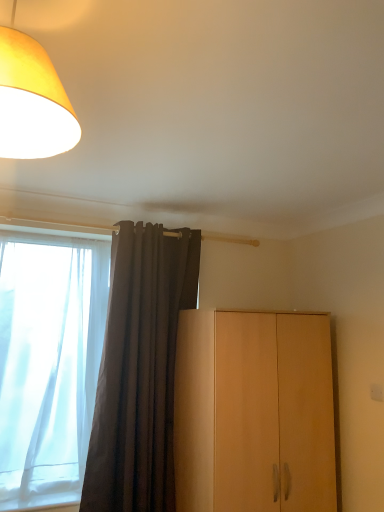
Question: From a real-world perspective, is dark gray fabric curtain at center located beneath white sheer curtain at left?

Choices:
 (A) no
 (B) yes

Answer: (B)

Question: Is dark gray fabric curtain at center positioned with its back to white sheer curtain at left?

Choices:
 (A) yes
 (B) no

Answer: (B)

Question: Can you confirm if dark gray fabric curtain at center is bigger than white sheer curtain at left?

Choices:
 (A) yes
 (B) no

Answer: (B)

Question: Is dark gray fabric curtain at center further to camera compared to white sheer curtain at left?

Choices:
 (A) no
 (B) yes

Answer: (A)

Question: Is dark gray fabric curtain at center shorter than white sheer curtain at left?

Choices:
 (A) yes
 (B) no

Answer: (B)

Question: From a real-world perspective, is yellow fabric lampshade at upper left above or below dark gray fabric curtain at center?

Choices:
 (A) above
 (B) below

Answer: (A)

Question: Is yellow fabric lampshade at upper left wider or thinner than dark gray fabric curtain at center?

Choices:
 (A) wide
 (B) thin

Answer: (A)

Question: Based on their sizes in the image, would you say yellow fabric lampshade at upper left is bigger or smaller than dark gray fabric curtain at center?

Choices:
 (A) small
 (B) big

Answer: (A)

Question: From the image's perspective, is yellow fabric lampshade at upper left positioned above or below dark gray fabric curtain at center?

Choices:
 (A) below
 (B) above

Answer: (B)

Question: Considering the relative positions of light wood cabinet at right and white sheer curtain at left in the image provided, is light wood cabinet at right to the left or to the right of white sheer curtain at left?

Choices:
 (A) right
 (B) left

Answer: (A)

Question: From a real-world perspective, relative to white sheer curtain at left, is light wood cabinet at right vertically above or below?

Choices:
 (A) below
 (B) above

Answer: (A)

Question: Considering the positions of light wood cabinet at right and white sheer curtain at left in the image, is light wood cabinet at right wider or thinner than white sheer curtain at left?

Choices:
 (A) wide
 (B) thin

Answer: (A)

Question: In terms of height, does light wood cabinet at right look taller or shorter compared to white sheer curtain at left?

Choices:
 (A) short
 (B) tall

Answer: (A)

Question: Based on their sizes in the image, would you say yellow fabric lampshade at upper left is bigger or smaller than light wood cabinet at right?

Choices:
 (A) big
 (B) small

Answer: (B)

Question: In terms of height, does yellow fabric lampshade at upper left look taller or shorter compared to light wood cabinet at right?

Choices:
 (A) tall
 (B) short

Answer: (B)